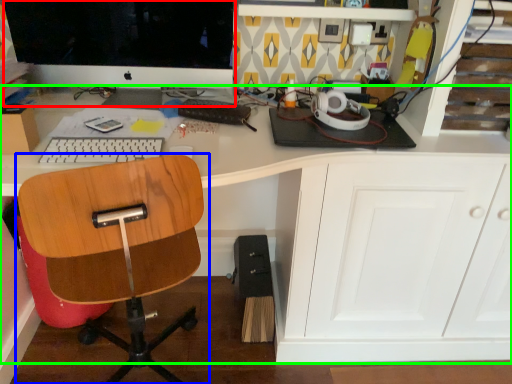
Question: Which object is the farthest from computer monitor (highlighted by a red box)? Choose among these: chair (highlighted by a blue box) or desk (highlighted by a green box).

Choices:
 (A) chair
 (B) desk

Answer: (A)